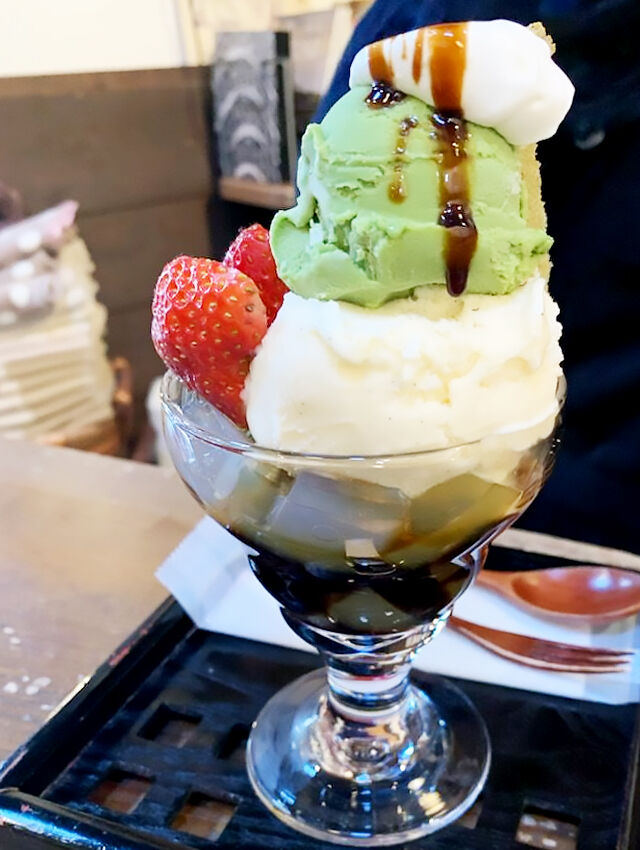
You are a GUI agent. You are given a task and a screenshot of the screen. Output one action in this format:
    pyautogui.click(x=<x>, y=<y>)
    Task: Click on the black serving trey
    
    Given the screenshot: What is the action you would take?
    pyautogui.click(x=157, y=748)